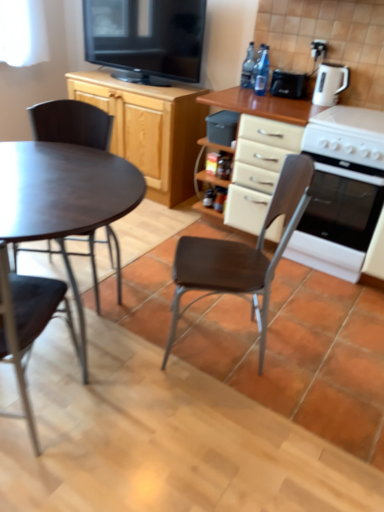
Where is `vacant region to the right of metallic dark brown chair at left, the first chair from the left`? The image size is (384, 512). vacant region to the right of metallic dark brown chair at left, the first chair from the left is located at coordinates (122, 429).